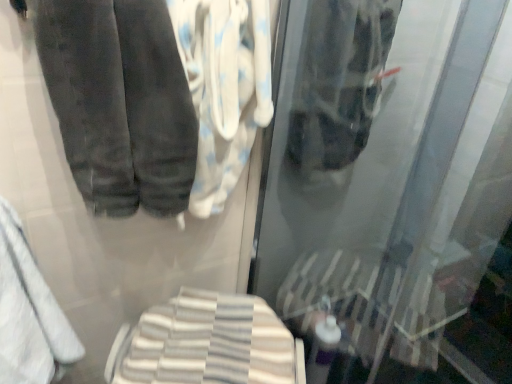
Question: From a real-world perspective, is white cotton towel at center, acting as the first cloth starting from the top, below white striped towel at lower center, the 2th cloth from the top?

Choices:
 (A) no
 (B) yes

Answer: (A)

Question: Is white cotton towel at center, placed as the second cloth when sorted from bottom to top, closer to camera compared to white striped towel at lower center, the 2th cloth from the top?

Choices:
 (A) no
 (B) yes

Answer: (B)

Question: Is white cotton towel at center, acting as the first cloth starting from the top, positioned far away from white striped towel at lower center, which ranks as the 1th cloth in bottom-to-top order?

Choices:
 (A) no
 (B) yes

Answer: (A)

Question: Considering the relative sizes of white cotton towel at center, placed as the second cloth when sorted from bottom to top, and white striped towel at lower center, the 2th cloth from the top, in the image provided, is white cotton towel at center, placed as the second cloth when sorted from bottom to top, wider than white striped towel at lower center, the 2th cloth from the top,?

Choices:
 (A) yes
 (B) no

Answer: (B)

Question: Does white cotton towel at center, acting as the first cloth starting from the top, have a greater height compared to white striped towel at lower center, which ranks as the 1th cloth in bottom-to-top order?

Choices:
 (A) yes
 (B) no

Answer: (A)

Question: Is point [x=35, y=357] positioned closer to the camera than point [x=244, y=122]?

Choices:
 (A) farther
 (B) closer

Answer: (B)

Question: Looking at their shapes, would you say white soft towel at lower left is wider or thinner than white cotton towel at center, acting as the first cloth starting from the top?

Choices:
 (A) wide
 (B) thin

Answer: (A)

Question: From their relative heights in the image, would you say white soft towel at lower left is taller or shorter than white cotton towel at center, acting as the first cloth starting from the top?

Choices:
 (A) tall
 (B) short

Answer: (A)

Question: From the image's perspective, is white soft towel at lower left above or below white cotton towel at center, acting as the first cloth starting from the top?

Choices:
 (A) above
 (B) below

Answer: (B)

Question: Is dark gray velvety trousers at upper left taller or shorter than white cotton towel at center, acting as the first cloth starting from the top?

Choices:
 (A) short
 (B) tall

Answer: (A)

Question: In the image, is dark gray velvety trousers at upper left on the left side or the right side of white cotton towel at center, placed as the second cloth when sorted from bottom to top?

Choices:
 (A) right
 (B) left

Answer: (B)

Question: In the image, is dark gray velvety trousers at upper left positioned in front of or behind white cotton towel at center, acting as the first cloth starting from the top?

Choices:
 (A) behind
 (B) front

Answer: (B)

Question: Considering the positions of point coord(159,39) and point coord(241,148), is point coord(159,39) closer or farther from the camera than point coord(241,148)?

Choices:
 (A) closer
 (B) farther

Answer: (A)

Question: In terms of width, does white cotton towel at center, placed as the second cloth when sorted from bottom to top, look wider or thinner when compared to white striped towel at lower center, the 2th cloth from the top?

Choices:
 (A) thin
 (B) wide

Answer: (A)

Question: Which is correct: white cotton towel at center, acting as the first cloth starting from the top, is inside white striped towel at lower center, the 2th cloth from the top, or outside of it?

Choices:
 (A) inside
 (B) outside

Answer: (B)